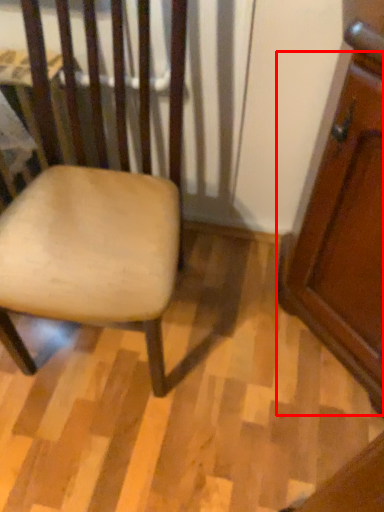
Question: From the image's perspective, where is screen door (annotated by the red box) located relative to chair?

Choices:
 (A) below
 (B) above

Answer: (A)